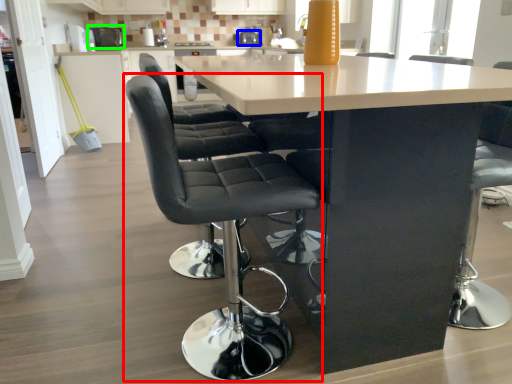
Question: Based on their relative distances, which object is nearer to chair (highlighted by a red box)? Choose from appliance (highlighted by a blue box) and appliance (highlighted by a green box).

Choices:
 (A) appliance
 (B) appliance

Answer: (A)